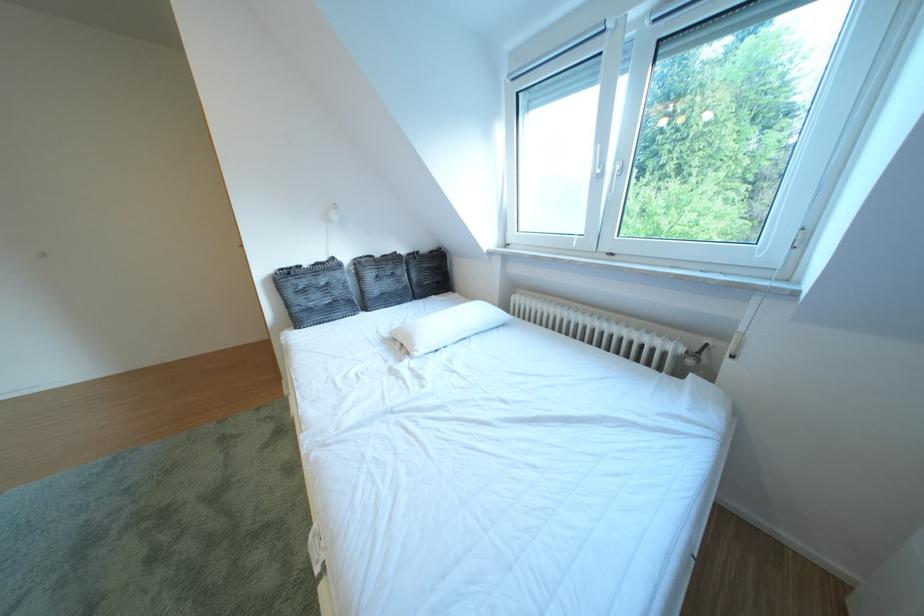
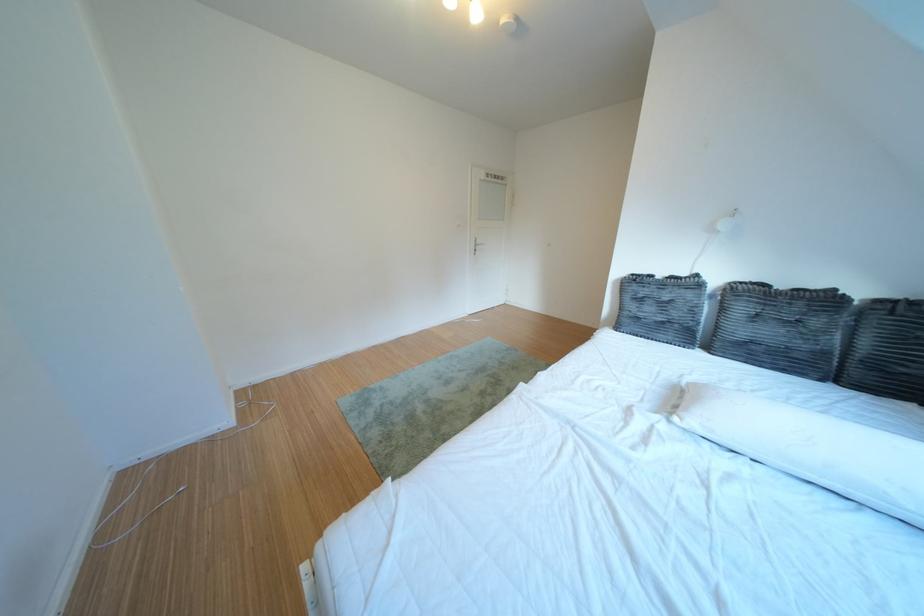
The point at (x=434, y=352) is marked in the first image. Where is the corresponding point in the second image?

(707, 424)